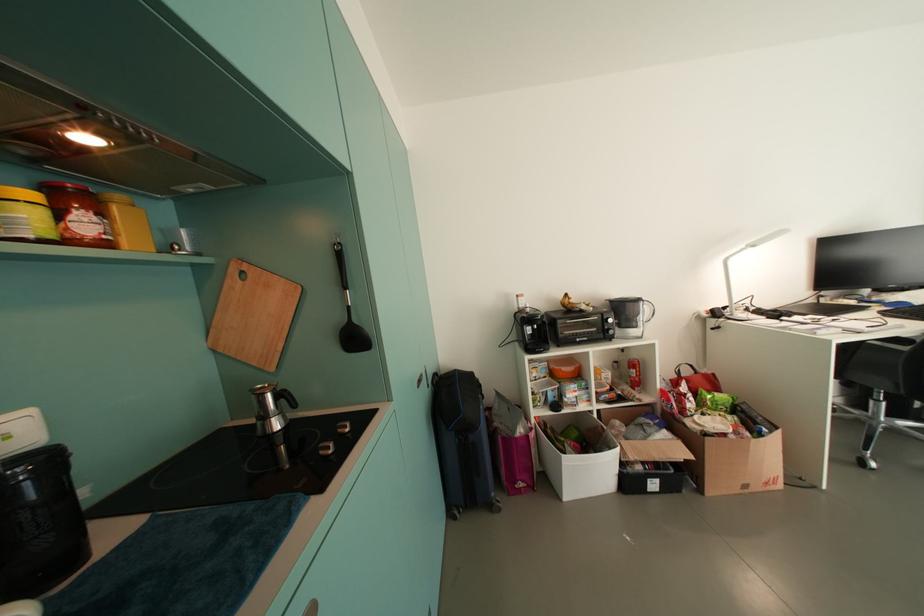
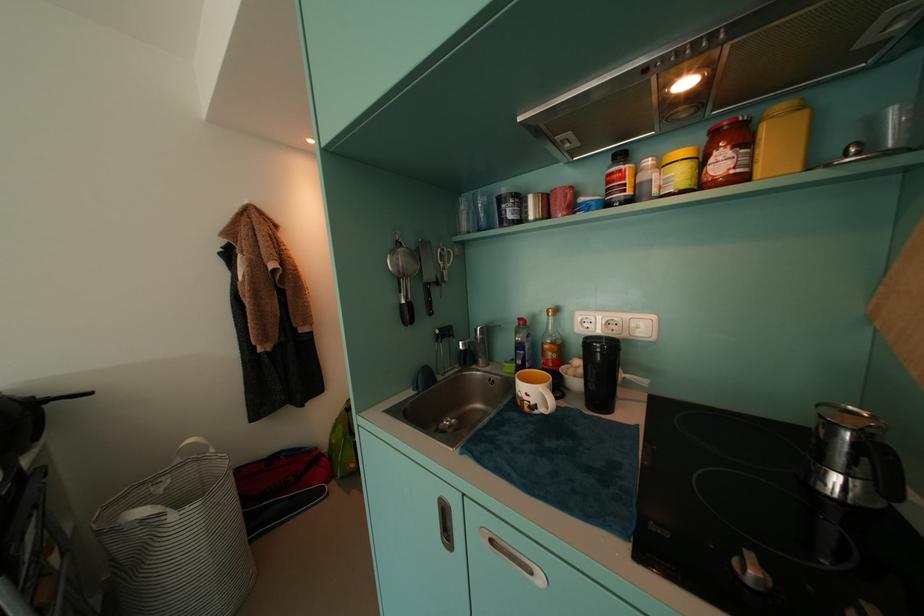
Where in the second image is the point corresponding to point (93, 228) from the first image?

(730, 166)